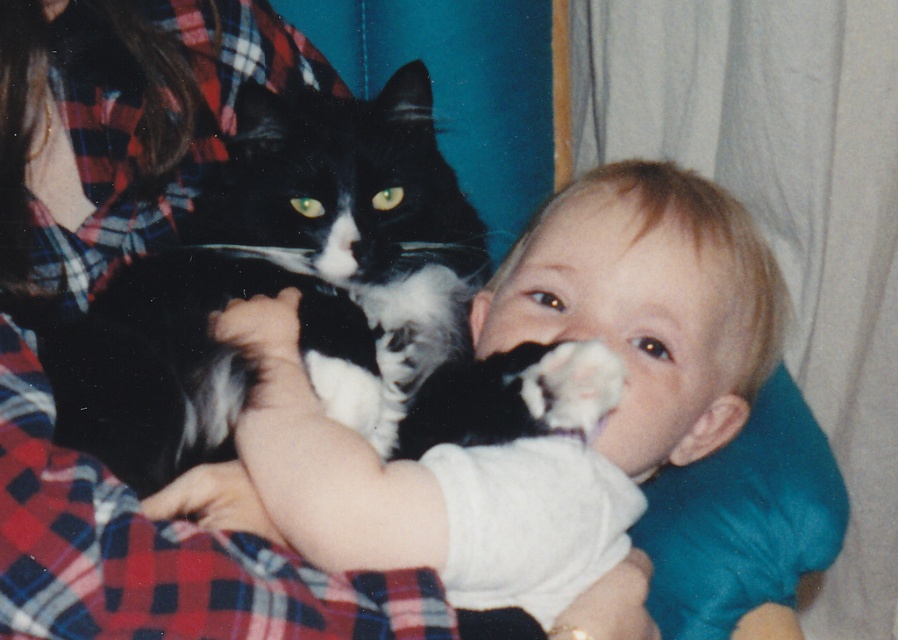
Consider the image. You are a photographer setting up for a family photo. You see the black and white fur cat at center and the white soft baby at center. Which subject should you adjust the camera focus on first if you want to ensure the taller subject is in focus first?

The white soft baby at center is taller than the black and white fur cat at center, so you should adjust the camera focus on the white soft baby at center first.